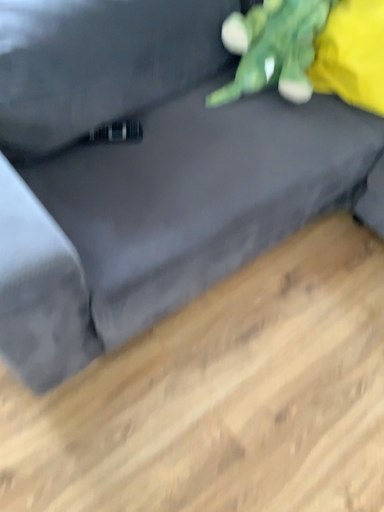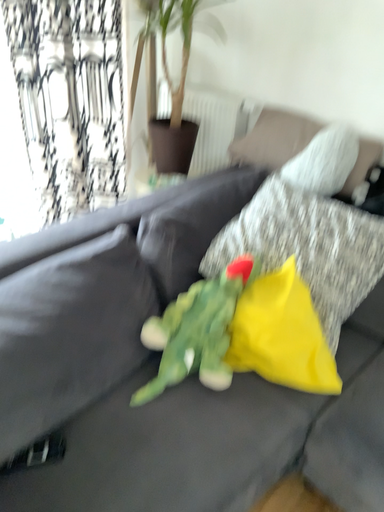
Question: How did the camera likely rotate when shooting the video?

Choices:
 (A) rotated upward
 (B) rotated downward

Answer: (A)